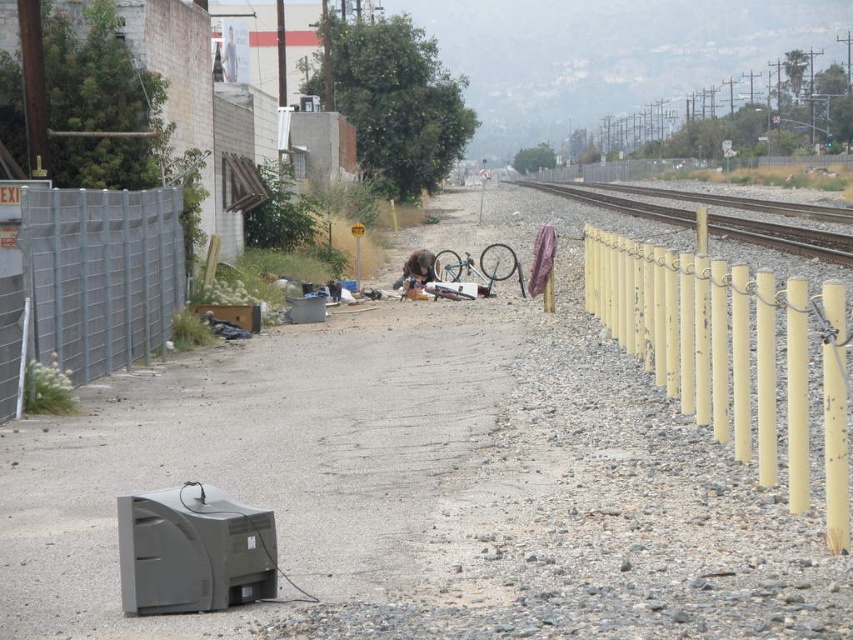
You are a pedestrian standing on the dirt path between the metal fence on the left and the yellow chain link fence on the right. You notice the yellow painted metal poles at right and the metallic train track at right. Which object is closer to you?

The yellow painted metal poles at right is closer to you because it is in front of the metallic train track at right.

You are a pedestrian standing on the dirt path between the metal fence on the left and the yellow chain link fence on the right. You notice the yellow painted metal poles at right and the metallic train track at right. Which object is closer to the ground?

The yellow painted metal poles at right is below metallic train track at right, so the yellow painted metal poles at right is closer to the ground.